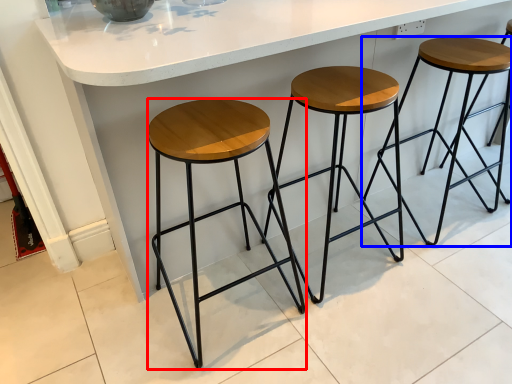
Question: Which point is further to the camera, stool (highlighted by a red box) or stool (highlighted by a blue box)?

Choices:
 (A) stool
 (B) stool

Answer: (B)